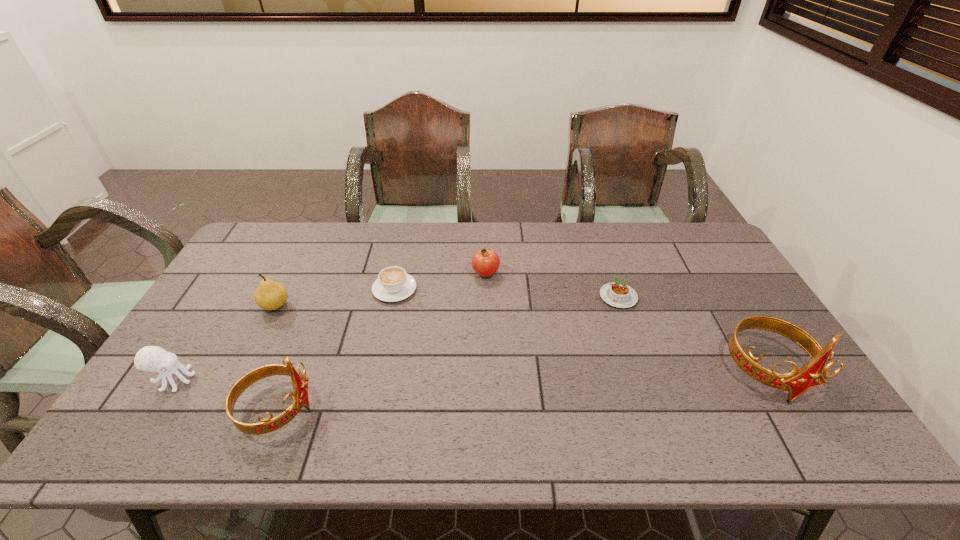
Where is `the shorter tiara`? This screenshot has width=960, height=540. the shorter tiara is located at coordinates (300, 382).

Locate an element on the screen. Image resolution: width=960 pixels, height=540 pixels. the left tiara is located at coordinates (300, 382).

Identify the location of the taller tiara. The width and height of the screenshot is (960, 540). (815, 372).

I want to click on the tallest object, so click(815, 372).

Identify the location of the second object from right to left. (616, 294).

Locate an element on the screen. Image resolution: width=960 pixels, height=540 pixels. pudding is located at coordinates (616, 294).

I want to click on the fourth object from right to left, so tap(393, 284).

Where is `the sixth tallest object`? the sixth tallest object is located at coordinates [393, 284].

The width and height of the screenshot is (960, 540). I want to click on pear, so click(270, 295).

You are a GUI agent. You are given a task and a screenshot of the screen. Output one action in this format:
    pyautogui.click(x=<x>, y=<y>)
    Task: Click on the fifth object from left to right
    
    Given the screenshot: What is the action you would take?
    pyautogui.click(x=485, y=262)